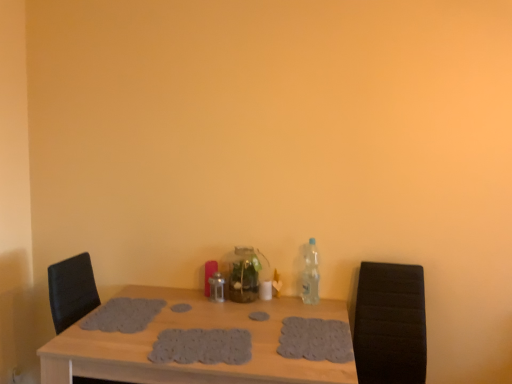
The width and height of the screenshot is (512, 384). I want to click on vacant space behind gray textured placemat at center, marked as the fourth footprint in a left-to-right arrangement, so click(x=315, y=310).